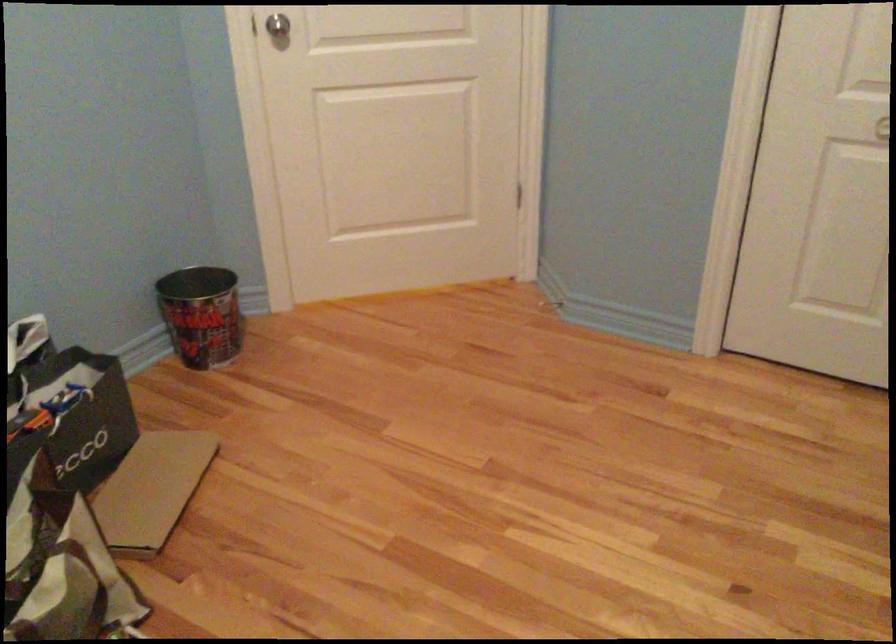
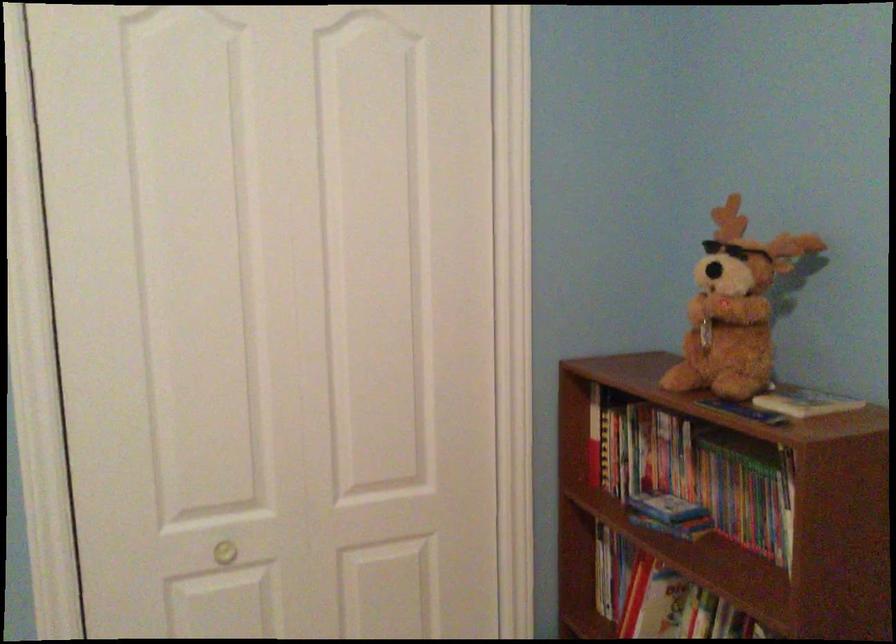
Question: The first image is from the beginning of the video and the second image is from the end. How did the camera likely rotate when shooting the video?

Choices:
 (A) Left
 (B) Right
 (C) Up
 (D) Down

Answer: (B)